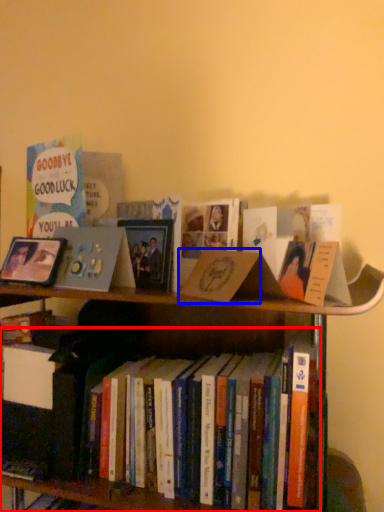
Question: Which of the following is the farthest to the observer, book (highlighted by a red box) or paperback book (highlighted by a blue box)?

Choices:
 (A) book
 (B) paperback book

Answer: (A)